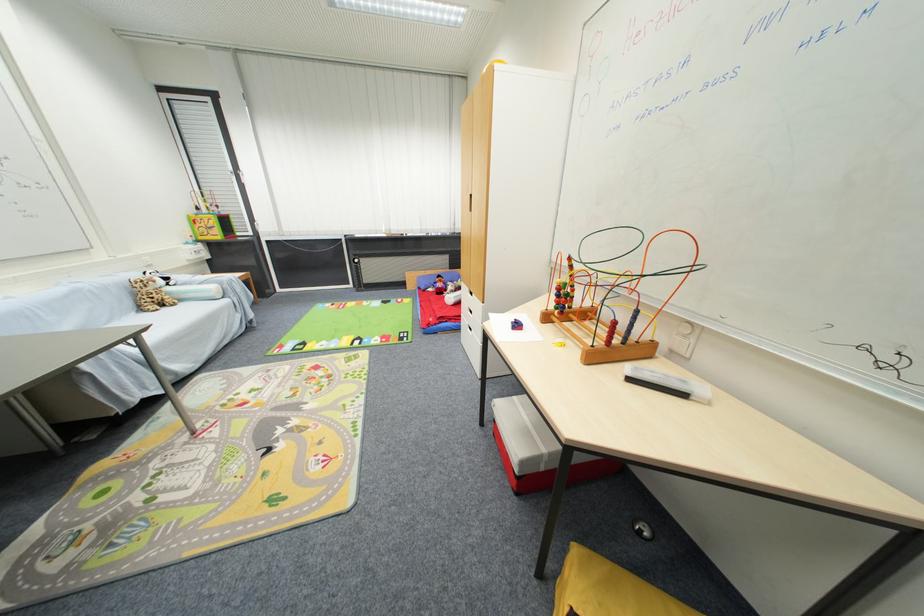
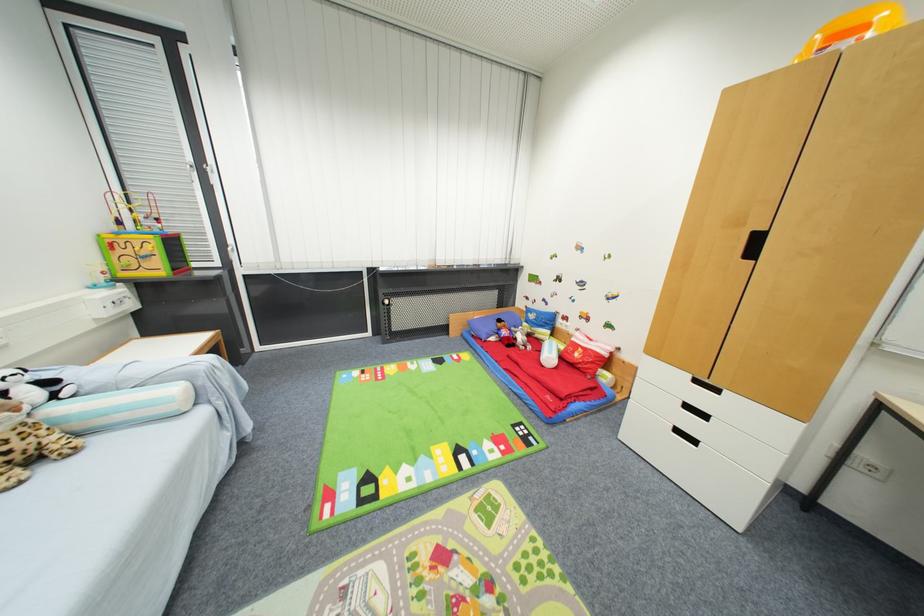
The point at (175, 291) is marked in the first image. Where is the corresponding point in the second image?

(64, 411)